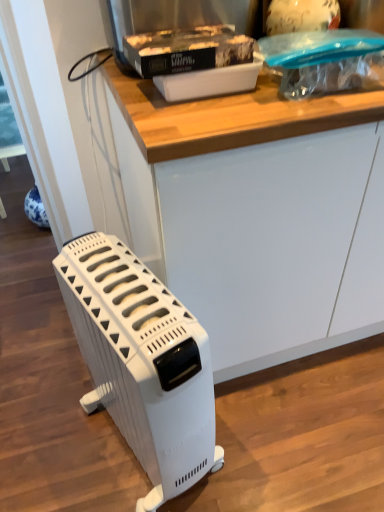
Question: From the image's perspective, relative to white plastic heater at lower left, is white plastic container at upper center above or below?

Choices:
 (A) below
 (B) above

Answer: (B)

Question: Looking at their shapes, would you say white plastic container at upper center is wider or thinner than white plastic heater at lower left?

Choices:
 (A) wide
 (B) thin

Answer: (B)

Question: Based on their relative distances, which object is farther from the white plastic container at upper center?

Choices:
 (A) white matte counter at center
 (B) white plastic heater at lower left

Answer: (B)

Question: Estimate the real-world distances between objects in this image. Which object is farther from the white plastic heater at lower left?

Choices:
 (A) white matte counter at center
 (B) white plastic container at upper center

Answer: (B)